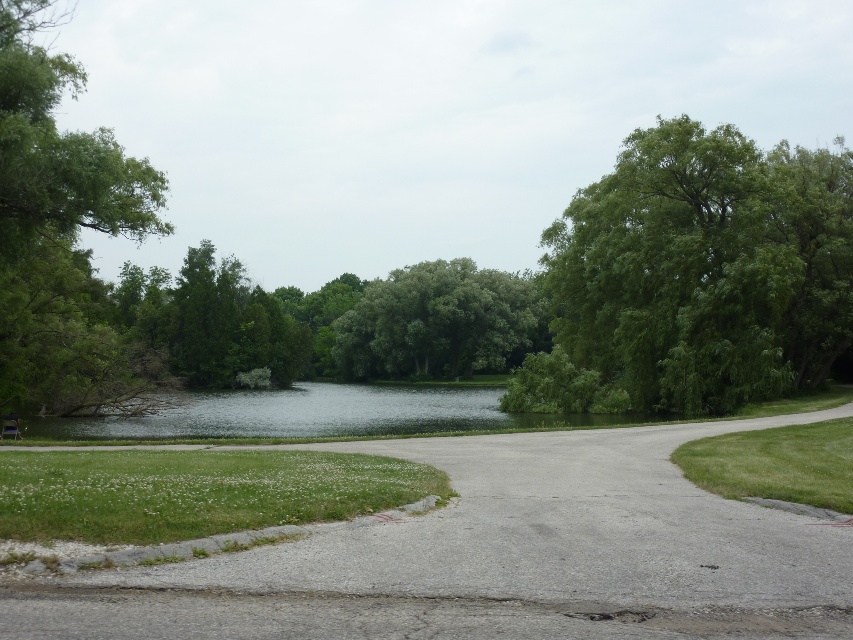
Question: Which object is positioned closest to the green leafy tree at upper right?

Choices:
 (A) gray asphalt driveway at center
 (B) green grass at lower right

Answer: (B)

Question: Observing the image, what is the correct spatial positioning of green leafy tree at upper right in reference to green grass at lower right?

Choices:
 (A) right
 (B) left

Answer: (A)

Question: Which of the following is the closest to the observer?

Choices:
 (A) (28, 124)
 (B) (260, 499)
 (C) (790, 467)

Answer: (B)

Question: Is green grass at lower left wider than green grass at lower right?

Choices:
 (A) no
 (B) yes

Answer: (B)

Question: Is green leafy tree at upper right to the right of green leafy tree at left from the viewer's perspective?

Choices:
 (A) yes
 (B) no

Answer: (A)

Question: Which object appears closest to the camera in this image?

Choices:
 (A) green leafy tree at center
 (B) green grass at lower right
 (C) green leafy tree at upper right

Answer: (B)